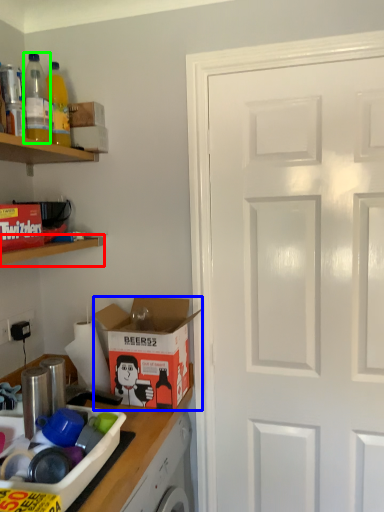
Question: Considering the real-world distances, which object is closest to shelf (highlighted by a red box)? cardboard box (highlighted by a blue box) or bottle (highlighted by a green box).

Choices:
 (A) cardboard box
 (B) bottle

Answer: (A)